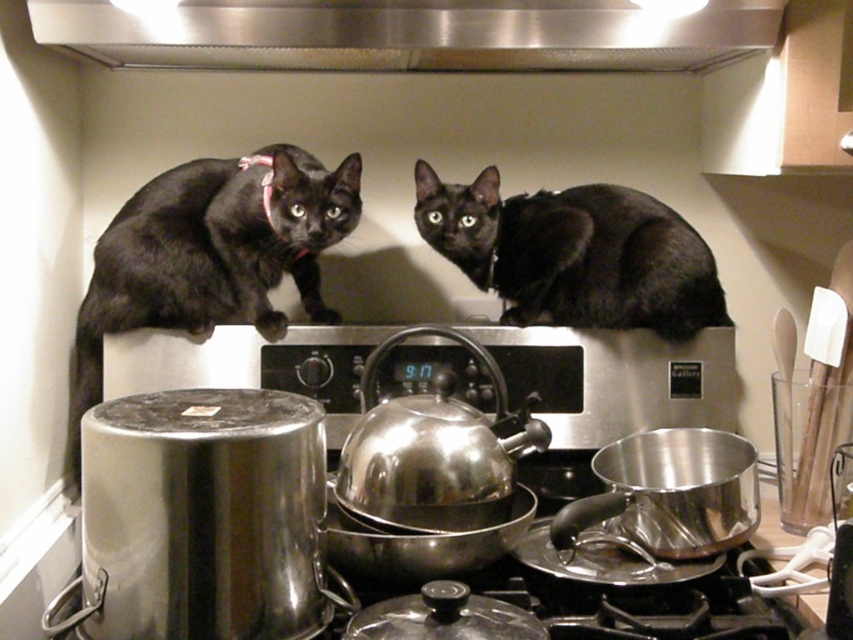
Can you confirm if stainless steel exhaust hood at upper center is smaller than black matte cat at upper center?

Incorrect, stainless steel exhaust hood at upper center is not smaller in size than black matte cat at upper center.

Which is in front, point (317, 48) or point (524, 269)?

Point (317, 48)

What are the coordinates of `stainless steel exhaust hood at upper center` in the screenshot? It's located at (408, 33).

Between matte black cat at upper left and black matte cat at upper center, which one is positioned lower?

Positioned lower is matte black cat at upper left.

This screenshot has height=640, width=853. What are the coordinates of `matte black cat at upper left` in the screenshot? It's located at (210, 253).

Identify the location of matte black cat at upper left. This screenshot has height=640, width=853. (210, 253).

This screenshot has width=853, height=640. I want to click on matte black cat at upper left, so click(x=210, y=253).

Does stainless steel exhaust hood at upper center appear on the right side of matte black cat at upper left?

Indeed, stainless steel exhaust hood at upper center is positioned on the right side of matte black cat at upper left.

Between stainless steel exhaust hood at upper center and matte black cat at upper left, which one appears on the left side from the viewer's perspective?

matte black cat at upper left

The image size is (853, 640). What are the coordinates of `stainless steel exhaust hood at upper center` in the screenshot? It's located at (408, 33).